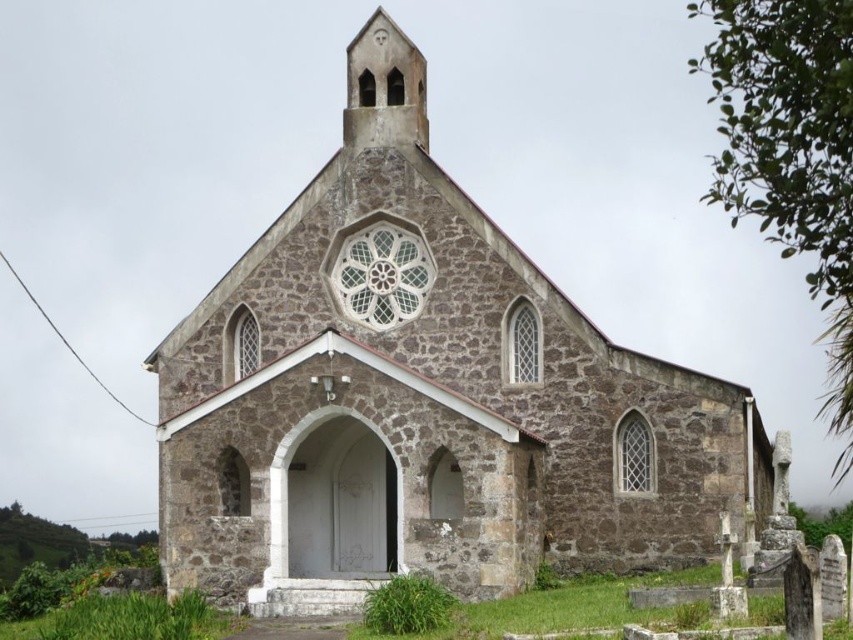
Question: Does brown stone church at center have a greater width compared to smooth stone spire at upper center?

Choices:
 (A) no
 (B) yes

Answer: (B)

Question: Among these objects, which one is nearest to the camera?

Choices:
 (A) smooth stone spire at upper center
 (B) brown stone church at center

Answer: (B)

Question: Which of the following is the farthest from the observer?

Choices:
 (A) (627, 456)
 (B) (410, 100)

Answer: (B)

Question: Which of the following is the farthest from the observer?

Choices:
 (A) brown stone church at center
 (B) smooth stone spire at upper center

Answer: (B)

Question: Is brown stone church at center smaller than smooth stone spire at upper center?

Choices:
 (A) yes
 (B) no

Answer: (B)

Question: Observing the image, what is the correct spatial positioning of brown stone church at center in reference to smooth stone spire at upper center?

Choices:
 (A) above
 (B) below

Answer: (B)